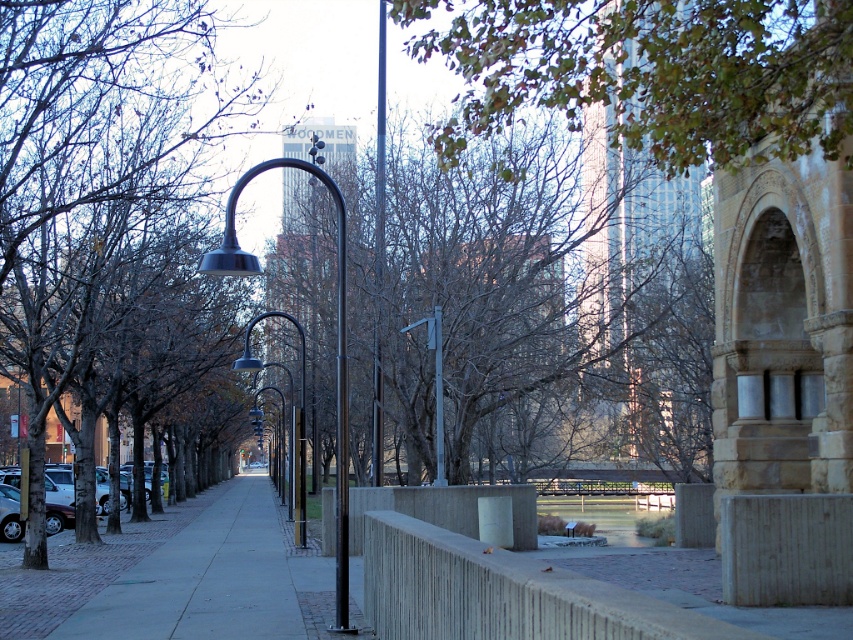
You are standing on the paved walkway and want to take a photo of both the brown leafy tree at center and the polished black street light at center. Which object should you focus on first to ensure both are in clear view?

You should focus on the brown leafy tree at center first because it is closer to you than the polished black street light at center, so adjusting focus from near to far will help both be in clear view.

You are a pedestrian walking along the walkway in the park and notice the green leafy tree at upper center and the silver metallic street light at center. Which object is positioned higher in the scene?

The green leafy tree at upper center is located above the silver metallic street light at center, so it is positioned higher in the scene.

You are standing at the point marked by the coordinates point (547, 300) in the park. Looking around, you see a brown leafy tree at center. Which direction should you walk to reach the nearest lamppost along the paved walkway?

The nearest lamppost along the paved walkway is located to the north of the point (547, 300). Therefore, you should walk north to reach it.